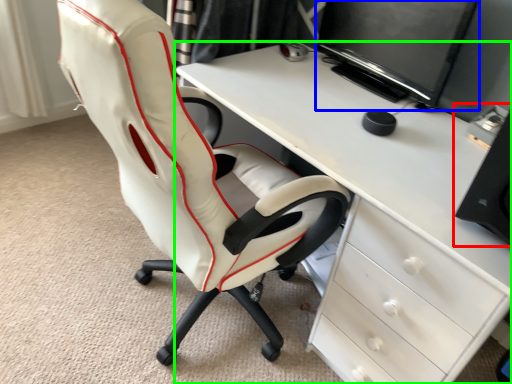
Question: Which object is positioned closest to computer tower (highlighted by a red box)? Select from computer monitor (highlighted by a blue box) and desk (highlighted by a green box).

Choices:
 (A) computer monitor
 (B) desk

Answer: (B)